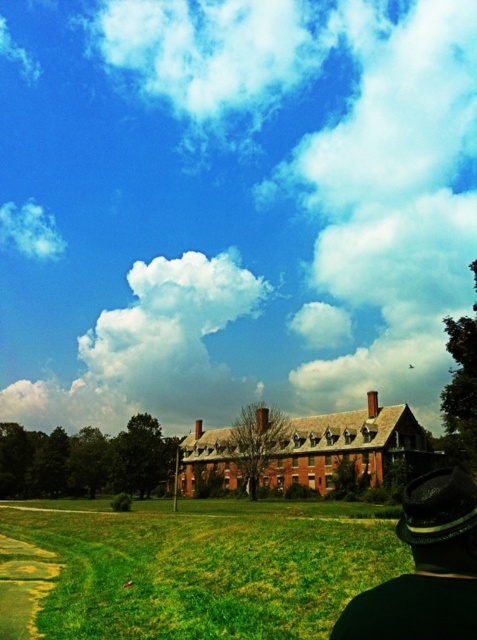
Question: Does black felt hat at lower right appear on the left side of white fluffy cloud at upper left?

Choices:
 (A) no
 (B) yes

Answer: (A)

Question: Where is green grass at lower center located in relation to black felt hat at lower right in the image?

Choices:
 (A) below
 (B) above

Answer: (A)

Question: Which of the following is the closest to the observer?

Choices:
 (A) (154, 625)
 (B) (420, 496)

Answer: (B)

Question: Which object appears closest to the camera in this image?

Choices:
 (A) black felt hat at lower right
 (B) white fluffy cloud at upper left
 (C) green grass at lower center

Answer: (A)

Question: Which point appears farthest from the camera in this image?

Choices:
 (A) (300, 636)
 (B) (58, 252)

Answer: (B)

Question: Can you confirm if black felt hat at lower right is positioned below white fluffy cloud at upper left?

Choices:
 (A) yes
 (B) no

Answer: (A)